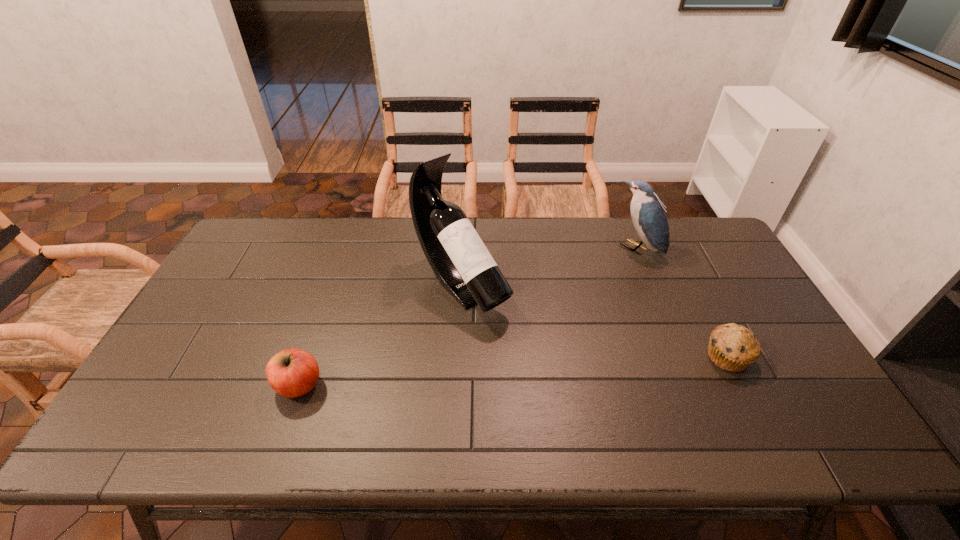
This screenshot has height=540, width=960. Find the location of `free space on the desktop that is between the third tallest object and the muffin and is positioned on the stand of the wine bottle`. free space on the desktop that is between the third tallest object and the muffin and is positioned on the stand of the wine bottle is located at coordinates (547, 369).

Locate an element on the screen. vacant spot on the desktop that is between the apple and the shortest object and is positioned at the tip of the third shortest object's beak is located at coordinates tap(486, 373).